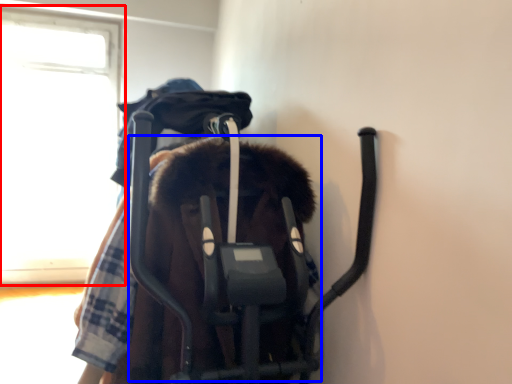
Question: Among these objects, which one is nearest to the camera, window (highlighted by a red box) or baby elephant (highlighted by a blue box)?

Choices:
 (A) window
 (B) baby elephant

Answer: (B)